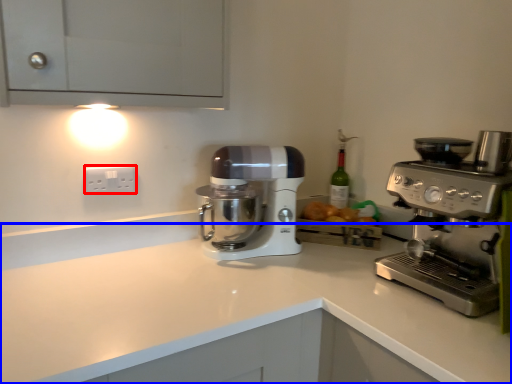
Question: Among these objects, which one is nearest to the camera, electric outlet (highlighted by a red box) or counter top (highlighted by a blue box)?

Choices:
 (A) electric outlet
 (B) counter top

Answer: (B)